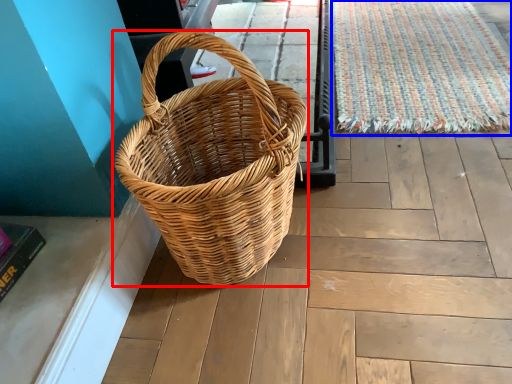
Question: Which object is closer to the camera taking this photo, picnic basket (highlighted by a red box) or doormat (highlighted by a blue box)?

Choices:
 (A) picnic basket
 (B) doormat

Answer: (A)